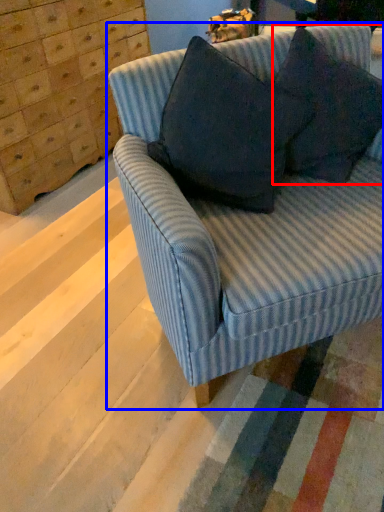
Question: Which of the following is the farthest to the observer, throw pillow (highlighted by a red box) or studio couch (highlighted by a blue box)?

Choices:
 (A) throw pillow
 (B) studio couch

Answer: (A)